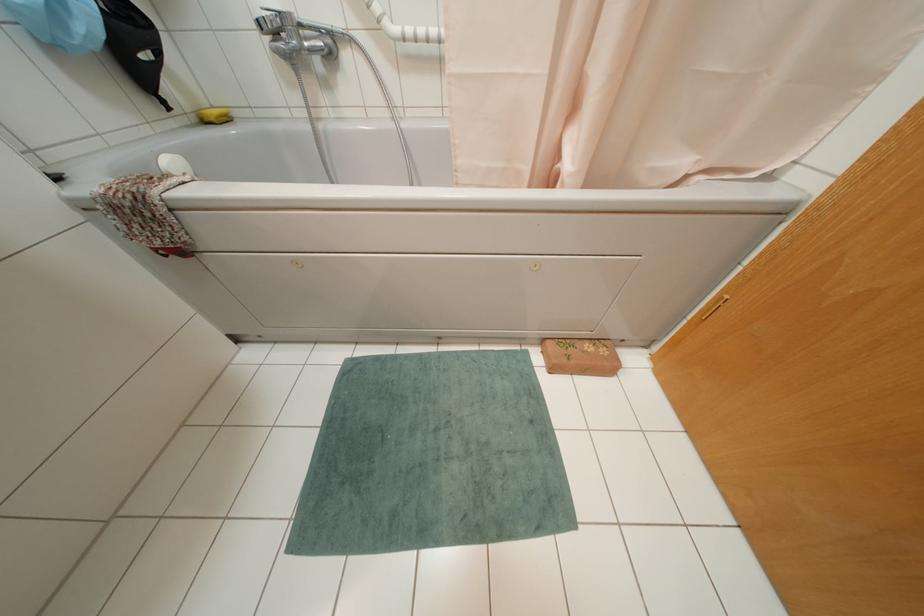
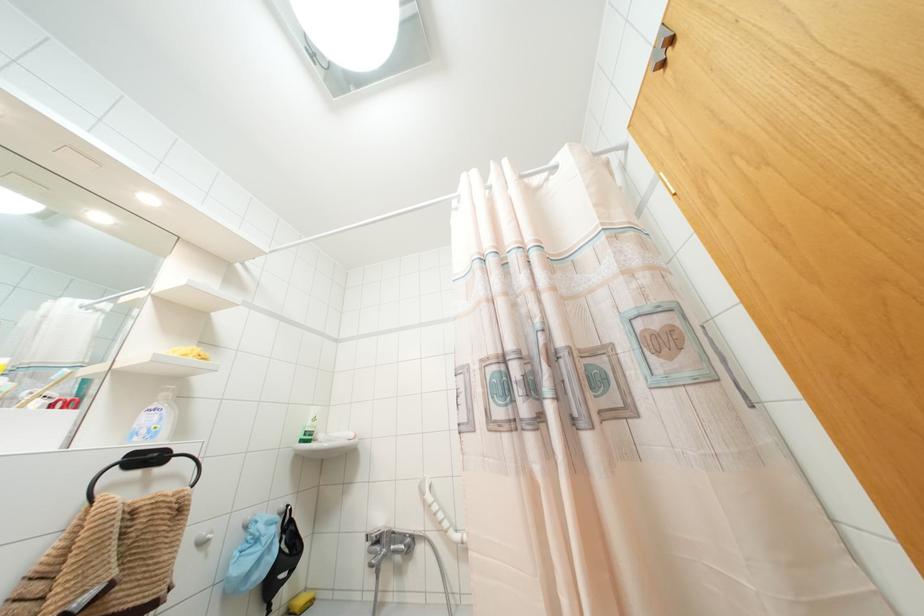
Locate, in the second image, the point that corresponds to pixel 211 111 in the first image.

(299, 601)